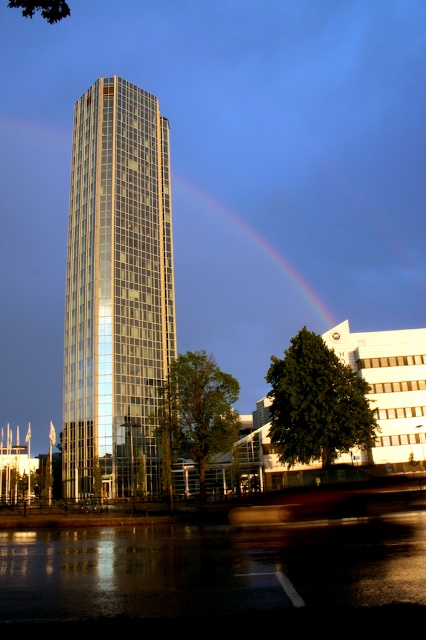
Does glassy metallic tower at center come behind rainbow at center?

That is False.

Can you confirm if glassy metallic tower at center is positioned to the right of rainbow at center?

In fact, glassy metallic tower at center is to the left of rainbow at center.

Which is behind, point (112, 360) or point (270, 253)?

Positioned behind is point (270, 253).

You are a GUI agent. You are given a task and a screenshot of the screen. Output one action in this format:
    pyautogui.click(x=<x>, y=<y>)
    Task: Click on the glassy metallic tower at center
    The image size is (426, 640).
    Given the screenshot: What is the action you would take?
    pyautogui.click(x=117, y=291)